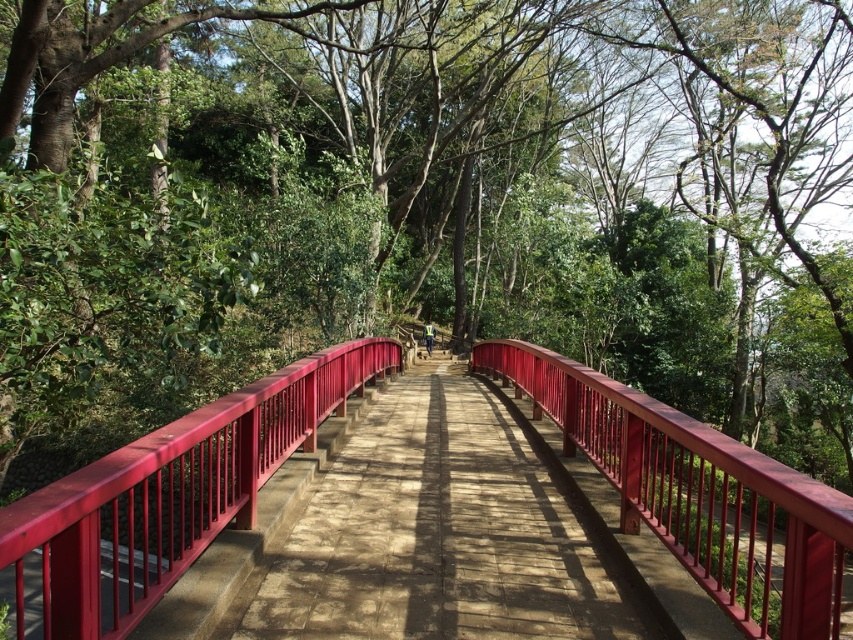
Question: Can you confirm if matte red bridge at center is thinner than glossy wood rail at center?

Choices:
 (A) no
 (B) yes

Answer: (B)

Question: Does matte red bridge at center come in front of glossy wood rail at center?

Choices:
 (A) yes
 (B) no

Answer: (A)

Question: Which object appears farthest from the camera in this image?

Choices:
 (A) glossy wood rail at center
 (B) matte red bridge at center
 (C) smooth wooden bridge at center

Answer: (C)

Question: Which of the following is the closest to the observer?

Choices:
 (A) glossy wood rail at center
 (B) smooth wooden bridge at center
 (C) matte red bridge at center

Answer: (C)

Question: Is smooth wooden bridge at center closer to camera compared to matte red bridge at center?

Choices:
 (A) no
 (B) yes

Answer: (A)

Question: Which object is the closest to the smooth wooden bridge at center?

Choices:
 (A) matte red bridge at center
 (B) glossy wood rail at center

Answer: (A)